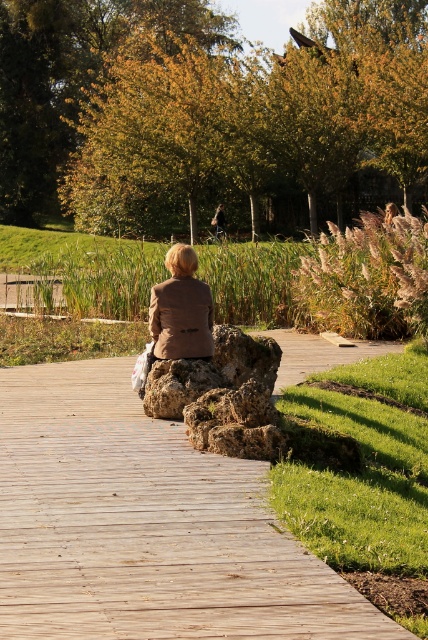
You are standing at the point labeled as point (145, 525) in the image. Looking around, you see a wooden boardwalk curving through the scene. Which direction should you walk to reach the person sitting on the large rugged rock?

The wooden boardwalk at center is located at point (145, 525). To reach the person sitting on the large rugged rock, you should walk along the boardwalk towards the direction where it curves. Since the person is at the edge of the boardwalk facing away towards the grassy area, following the boardwalk towards the end will lead you directly to them.

You are standing at the edge of the wooden boardwalk in the park scene and see two points marked on the ground. Which point, point (195,348) or point (223,218), is closer to you?

Point (195,348) is closer to the viewer than point (223,218).

You are a park ranger who needs to place a new bench on the wooden boardwalk. The bench you have is the same size as the dark brown leather jacket at center. Will the bench fit on the wooden at center?

The wooden at center is wider than the dark brown leather jacket at center, so the bench will fit on the wooden at center since its width is larger than the bench.